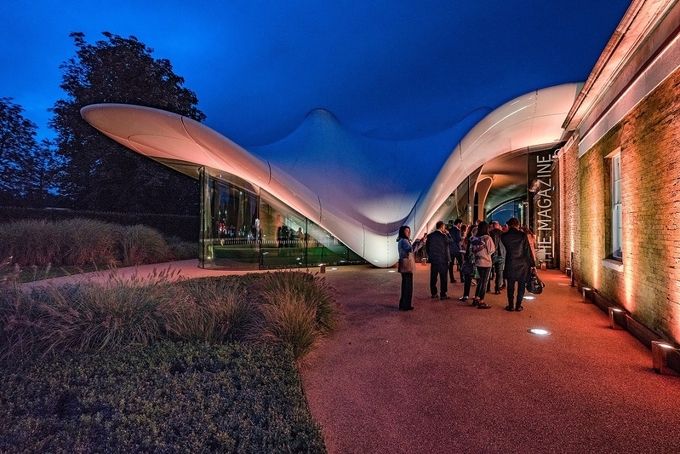
You are a GUI agent. You are given a task and a screenshot of the screen. Output one action in this format:
    pyautogui.click(x=<x>, y=<y>)
    Task: Click on the lights
    The width and height of the screenshot is (680, 454).
    Given the screenshot: What is the action you would take?
    pyautogui.click(x=544, y=332), pyautogui.click(x=525, y=301), pyautogui.click(x=583, y=288), pyautogui.click(x=608, y=310), pyautogui.click(x=657, y=348)